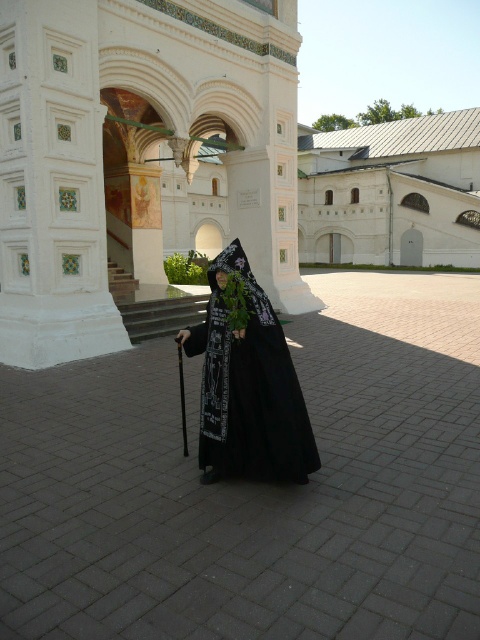
Who is lower down, black fabric courtyard at center or white smooth building at center?

black fabric courtyard at center is below.

Who is positioned more to the left, black fabric courtyard at center or white smooth building at center?

From the viewer's perspective, black fabric courtyard at center appears more on the left side.

Locate an element on the screen. This screenshot has width=480, height=640. black fabric courtyard at center is located at coordinates (255, 486).

Is point (399, 442) less distant than point (237, 465)?

No, (399, 442) is behind (237, 465).

Identify the location of black fabric courtyard at center. This screenshot has width=480, height=640. (255, 486).

At what (x,y) coordinates should I click in order to perform the action: click on black fabric courtyard at center. Please return your answer as a coordinate pair (x, y). Looking at the image, I should click on (255, 486).

Is the position of white smooth building at center less distant than that of black matte/velvet cloak at center?

No.

Locate an element on the screen. white smooth building at center is located at coordinates (392, 193).